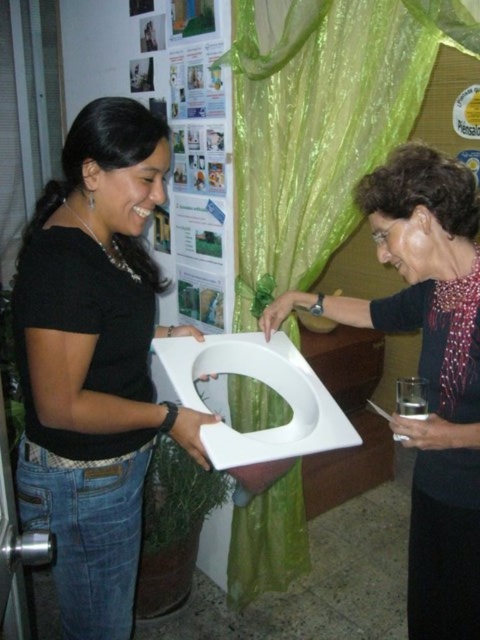
Does black matte toilet at center have a smaller size compared to green sheer curtain at center?

Yes.

Who is positioned more to the left, black matte toilet at center or green sheer curtain at center?

black matte toilet at center is more to the left.

This screenshot has height=640, width=480. I want to click on black matte toilet at center, so click(x=95, y=362).